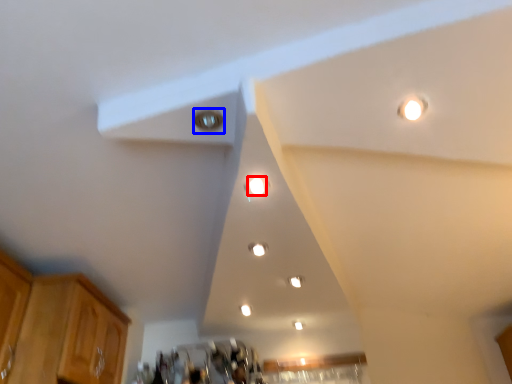
Question: Among these objects, which one is nearest to the camera, dot (highlighted by a red box) or light (highlighted by a blue box)?

Choices:
 (A) dot
 (B) light

Answer: (B)